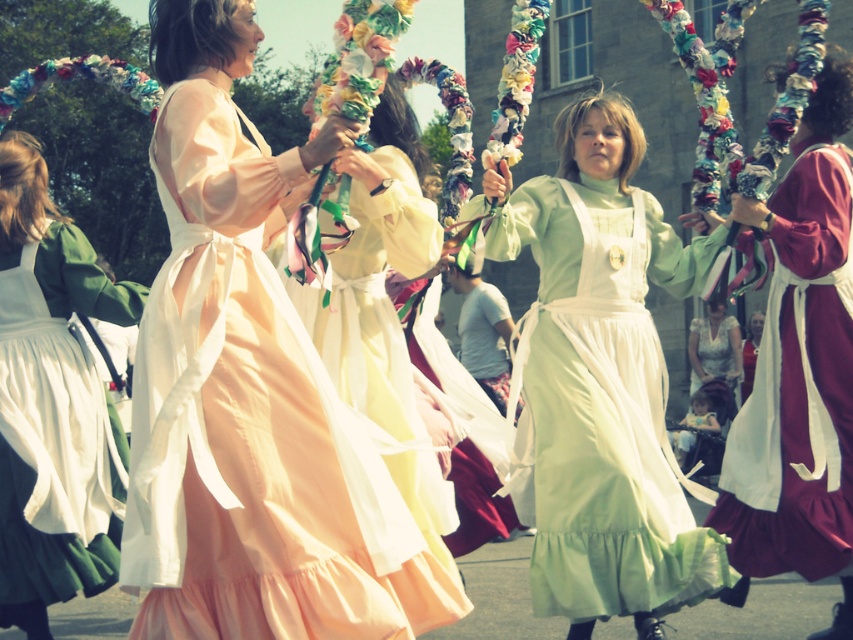
You are a photographer at the May Day celebration and want to capture both the light green cotton dress at center and the green satin dress at left in a single wide shot. Given that your camera has a maximum focus range of 15 meters, will you be able to include both subjects in focus?

The distance between the light green cotton dress at center and the green satin dress at left is 13.69 meters, which is within the camera s maximum focus range of 15 meters. Therefore, both subjects can be captured in focus in a single wide shot.

You are a costume designer observing the May Day celebration scene. You need to determine which dress has a wider silhouette between the light green cotton dress at center and the green satin dress at left. Based on the scene, which one is wider?

The light green cotton dress at center has a larger width than the green satin dress at left, so the light green cotton dress at center has a wider silhouette.

You are a photographer at the May Day celebration and want to ensure both the light pink satin dress at center and the light green cotton dress at center are clearly visible in your photo. Given their sizes, which dress should you focus on to capture more detail without overfilling the frame?

The light pink satin dress at center is larger in size compared to the light green cotton dress at center, so focusing on it would allow you to capture more detail without overfilling the frame.